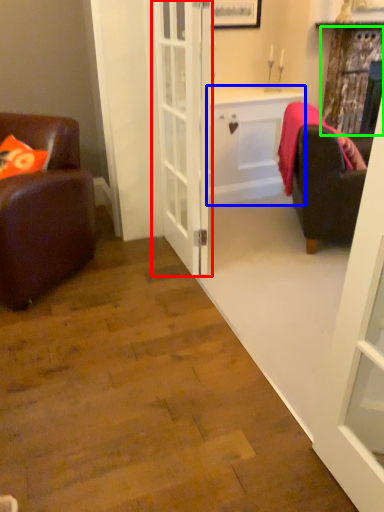
Question: Which object is the closest to the door (highlighted by a red box)? Choose among these: cabinetry (highlighted by a blue box) or curtain (highlighted by a green box).

Choices:
 (A) cabinetry
 (B) curtain

Answer: (A)